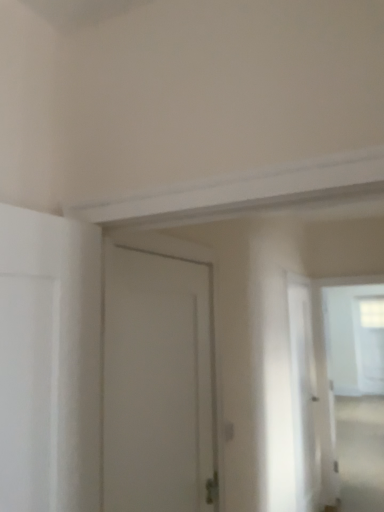
Question: From the image's perspective, is white matte door at center beneath transparent glass window at upper right?

Choices:
 (A) no
 (B) yes

Answer: (A)

Question: Is white matte door at center far from transparent glass window at upper right?

Choices:
 (A) no
 (B) yes

Answer: (B)

Question: Does white matte door at center lie behind transparent glass window at upper right?

Choices:
 (A) yes
 (B) no

Answer: (B)

Question: From a real-world perspective, does white matte door at center stand above transparent glass window at upper right?

Choices:
 (A) yes
 (B) no

Answer: (A)

Question: Does white matte door at center have a larger size compared to transparent glass window at upper right?

Choices:
 (A) yes
 (B) no

Answer: (B)

Question: Considering the positions of white matte door at center and transparent glass window at upper right in the image, is white matte door at center taller or shorter than transparent glass window at upper right?

Choices:
 (A) tall
 (B) short

Answer: (B)

Question: Is point (125, 340) closer or farther from the camera than point (362, 305)?

Choices:
 (A) closer
 (B) farther

Answer: (A)

Question: Looking at the image, does white matte door at center seem bigger or smaller compared to transparent glass window at upper right?

Choices:
 (A) small
 (B) big

Answer: (A)

Question: Relative to transparent glass window at upper right, is white matte door at center in front or behind?

Choices:
 (A) behind
 (B) front

Answer: (B)

Question: Is transparent plastic screen door at right in front of or behind transparent glass window at upper right in the image?

Choices:
 (A) front
 (B) behind

Answer: (A)

Question: In terms of size, does transparent plastic screen door at right appear bigger or smaller than transparent glass window at upper right?

Choices:
 (A) small
 (B) big

Answer: (A)

Question: Is transparent plastic screen door at right taller or shorter than transparent glass window at upper right?

Choices:
 (A) short
 (B) tall

Answer: (A)

Question: Does point (317, 497) appear closer or farther from the camera than point (360, 340)?

Choices:
 (A) closer
 (B) farther

Answer: (A)

Question: Looking at the image, does white matte door at center seem bigger or smaller compared to transparent plastic screen door at right?

Choices:
 (A) big
 (B) small

Answer: (B)

Question: Considering their positions, is white matte door at center located in front of or behind transparent plastic screen door at right?

Choices:
 (A) behind
 (B) front

Answer: (B)